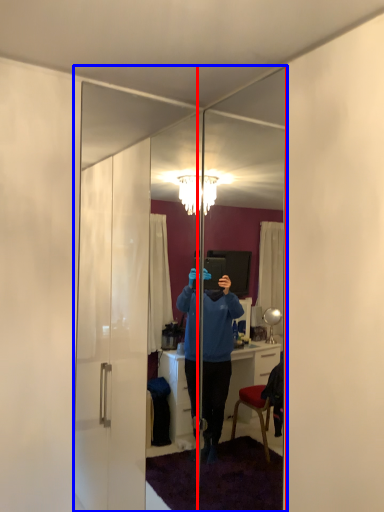
Question: Which point is closer to the camera, mirror (highlighted by a red box) or mirror (highlighted by a blue box)?

Choices:
 (A) mirror
 (B) mirror

Answer: (A)